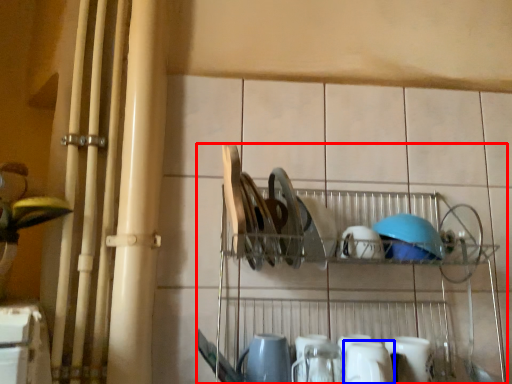
Question: Which point is further to the camera, shelf (highlighted by a red box) or tableware (highlighted by a blue box)?

Choices:
 (A) shelf
 (B) tableware

Answer: (B)